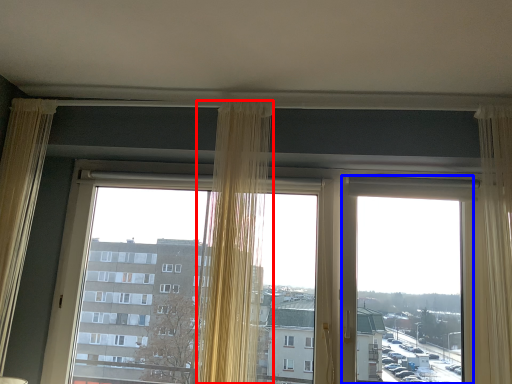
Question: Which of the following is the closest to the observer, curtain (highlighted by a red box) or window screen (highlighted by a blue box)?

Choices:
 (A) curtain
 (B) window screen

Answer: (A)